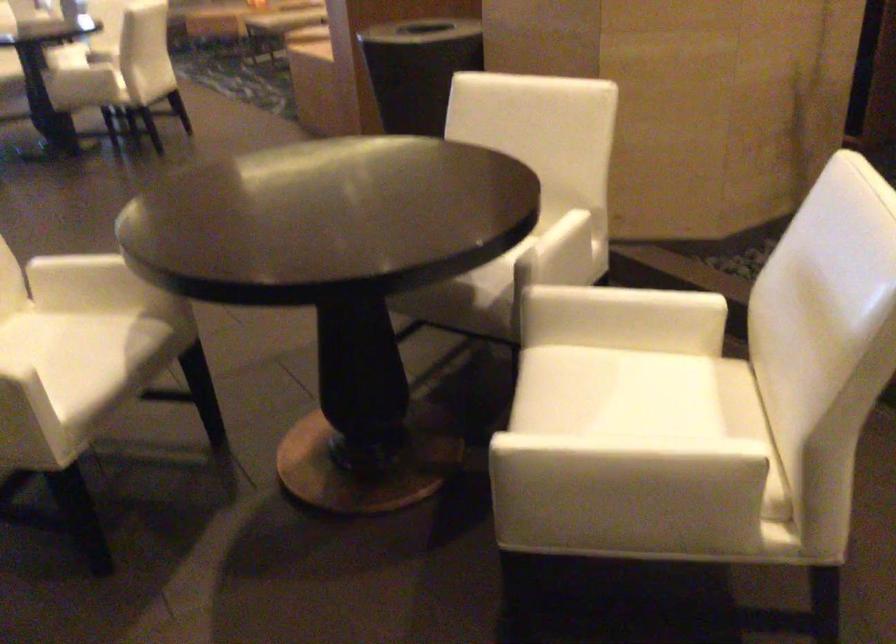
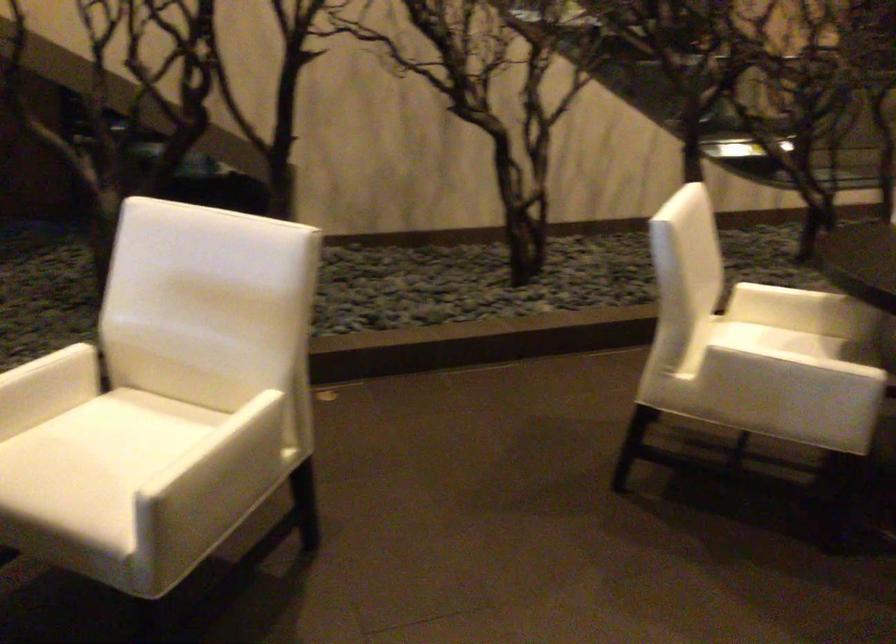
Where in the second image is the point corresponding to [612,471] from the first image?

(225, 462)